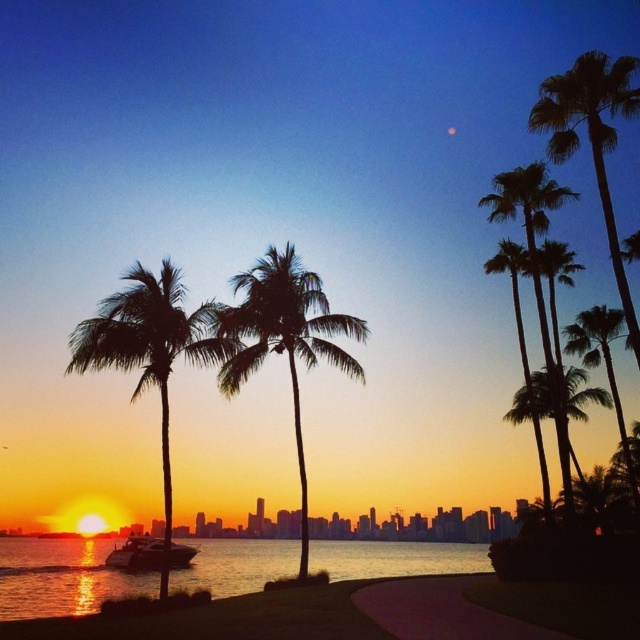
Question: Estimate the real-world distances between objects in this image. Which object is farther from the silky black palm trees at upper right?

Choices:
 (A) shiny reflective water at lower left
 (B) green leafy palm tree at left
 (C) shiny silver yacht at lower left

Answer: (A)

Question: Can you confirm if silhouette palm tree at center is positioned below silky black palm trees at upper right?

Choices:
 (A) no
 (B) yes

Answer: (B)

Question: Which point is farther to the camera?

Choices:
 (A) silhouette leafy palm at upper right
 (B) silhouette palm tree at center
 (C) shiny silver yacht at lower left
 (D) green leafy palm tree at center-right

Answer: (D)

Question: Which point appears closest to the camera in this image?

Choices:
 (A) click(x=192, y=586)
 (B) click(x=600, y=358)
 (C) click(x=612, y=106)

Answer: (C)

Question: Is silky green palm tree at right behind silky black palm tree at right?

Choices:
 (A) no
 (B) yes

Answer: (B)

Question: Is silky black palm trees at upper right smaller than silky green palm tree at right?

Choices:
 (A) no
 (B) yes

Answer: (A)